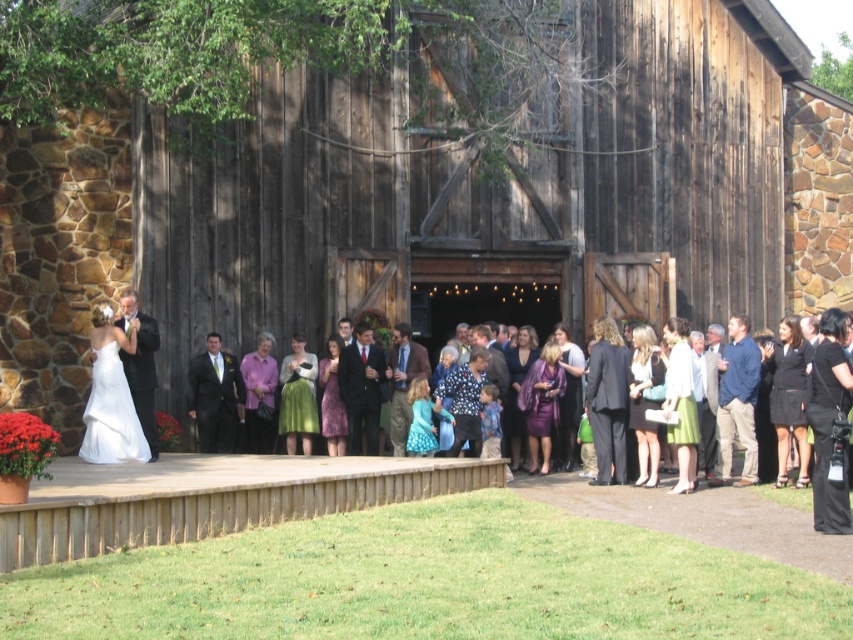
You are standing at the point labeled point (167,202) and want to take a photo of the wedding ceremony platform. If your camera can focus on objects up to 20 meters away, will you be able to capture the ceremony platform clearly?

The distance between point (167,202) and the camera is 20.57 meters, which exceeds the camera maximum focus range of 20 meters. Therefore, you won not be able to capture the ceremony platform clearly.

You are standing at the entrance of the wedding venue and want to take a photo of the dark wood barn at center. According to the scene description, where should you position yourself to capture the barn in the center of your photo?

To capture the dark wood barn at center in the center of your photo, you should position yourself directly in front of the barn at point (438, 196) as specified in the scene description.

You are a photographer at the wedding ceremony. You want to capture a photo that includes both the dark wood barn at center and the matte black suit at center. Considering their sizes, which one should you frame first to ensure both fit in the shot?

The dark wood barn at center is wider than the matte black suit at center, so you should frame the dark wood barn at center first to ensure both fit in the shot.